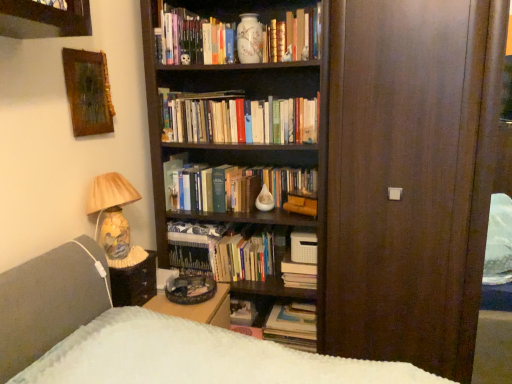
Question: From a real-world perspective, does matte ceramic lamp at left sit lower than wooden side table at lower left?

Choices:
 (A) no
 (B) yes

Answer: (A)

Question: Is matte ceramic lamp at left surrounding wooden side table at lower left?

Choices:
 (A) yes
 (B) no

Answer: (B)

Question: Can you confirm if matte ceramic lamp at left is positioned to the right of wooden side table at lower left?

Choices:
 (A) yes
 (B) no

Answer: (B)

Question: Is matte ceramic lamp at left touching wooden side table at lower left?

Choices:
 (A) yes
 (B) no

Answer: (B)

Question: From a real-world perspective, is matte ceramic lamp at left on top of wooden side table at lower left?

Choices:
 (A) no
 (B) yes

Answer: (B)

Question: Is matte ceramic lamp at left taller than wooden side table at lower left?

Choices:
 (A) no
 (B) yes

Answer: (B)

Question: Is matte white vase at upper center, the 1th book from the top, far away from hardcover books at center, acting as the 3th book starting from the top?

Choices:
 (A) yes
 (B) no

Answer: (B)

Question: From a real-world perspective, does matte white vase at upper center, the 7th book from the bottom, sit lower than hardcover books at center, which ranks as the 5th book in bottom-to-top order?

Choices:
 (A) yes
 (B) no

Answer: (B)

Question: From the image's perspective, is matte white vase at upper center, the 1th book from the top, on hardcover books at center, acting as the 3th book starting from the top?

Choices:
 (A) yes
 (B) no

Answer: (A)

Question: From the image's perspective, is matte white vase at upper center, the 7th book from the bottom, under hardcover books at center, which ranks as the 5th book in bottom-to-top order?

Choices:
 (A) yes
 (B) no

Answer: (B)

Question: Considering the relative sizes of matte white vase at upper center, the 1th book from the top, and hardcover books at center, acting as the 3th book starting from the top, in the image provided, is matte white vase at upper center, the 1th book from the top, thinner than hardcover books at center, acting as the 3th book starting from the top,?

Choices:
 (A) yes
 (B) no

Answer: (B)

Question: Is matte white vase at upper center, the 1th book from the top, oriented towards hardcover books at center, acting as the 3th book starting from the top?

Choices:
 (A) no
 (B) yes

Answer: (A)

Question: Would you say matte ceramic vase at upper center, placed as the sixth book when sorted from bottom to top, contains matte white vase at upper center, the 7th book from the bottom?

Choices:
 (A) no
 (B) yes

Answer: (A)